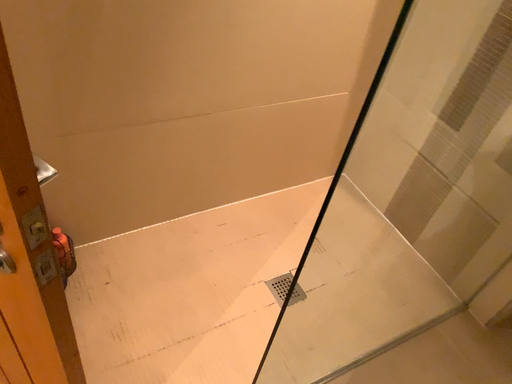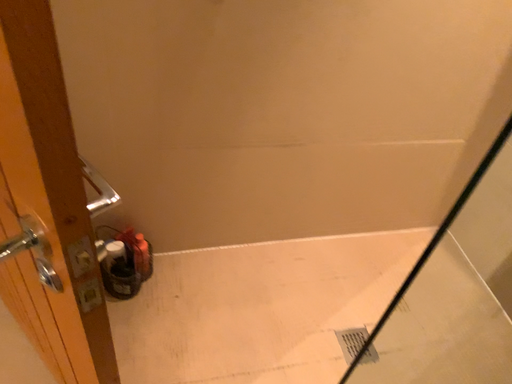
Question: Which way did the camera rotate in the video?

Choices:
 (A) rotated right
 (B) rotated left

Answer: (B)